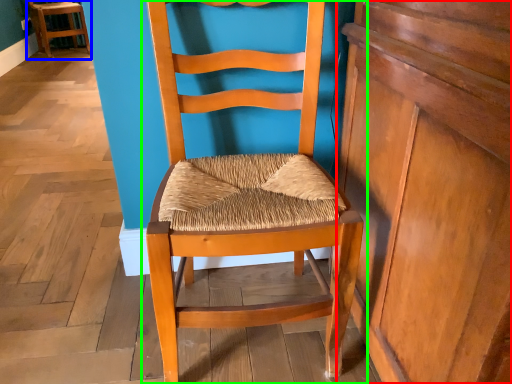
Question: Considering the real-world distances, which object is closest to dresser (highlighted by a red box)? chair (highlighted by a blue box) or chair (highlighted by a green box).

Choices:
 (A) chair
 (B) chair

Answer: (B)